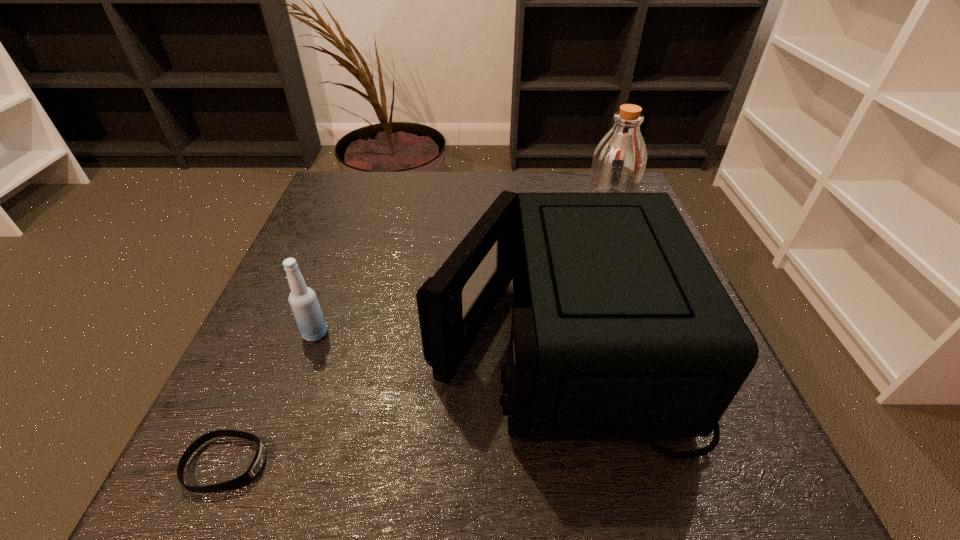
The width and height of the screenshot is (960, 540). I want to click on the taller bottle, so click(x=619, y=160).

In order to click on the farthest object in this screenshot , I will do `click(619, 160)`.

I want to click on microwave oven, so click(x=621, y=328).

This screenshot has height=540, width=960. I want to click on the shorter bottle, so click(x=303, y=301).

The image size is (960, 540). Find the location of `the nearer bottle`. the nearer bottle is located at coordinates (303, 301).

This screenshot has width=960, height=540. I want to click on the shortest object, so click(250, 474).

Where is `vacant region located on the left of the right bottle`? The image size is (960, 540). vacant region located on the left of the right bottle is located at coordinates (448, 199).

This screenshot has width=960, height=540. Identify the location of free space located 0.060m with the door open on the microwave oven. (396, 336).

Find the location of `vacant region located 0.100m with the door open on the microwave oven`. vacant region located 0.100m with the door open on the microwave oven is located at coordinates (374, 336).

At what (x,y) coordinates should I click in order to perform the action: click on vacant space located with the door open on the microwave oven. Please return your answer as a coordinate pair (x, y). The height and width of the screenshot is (540, 960). Looking at the image, I should click on (290, 336).